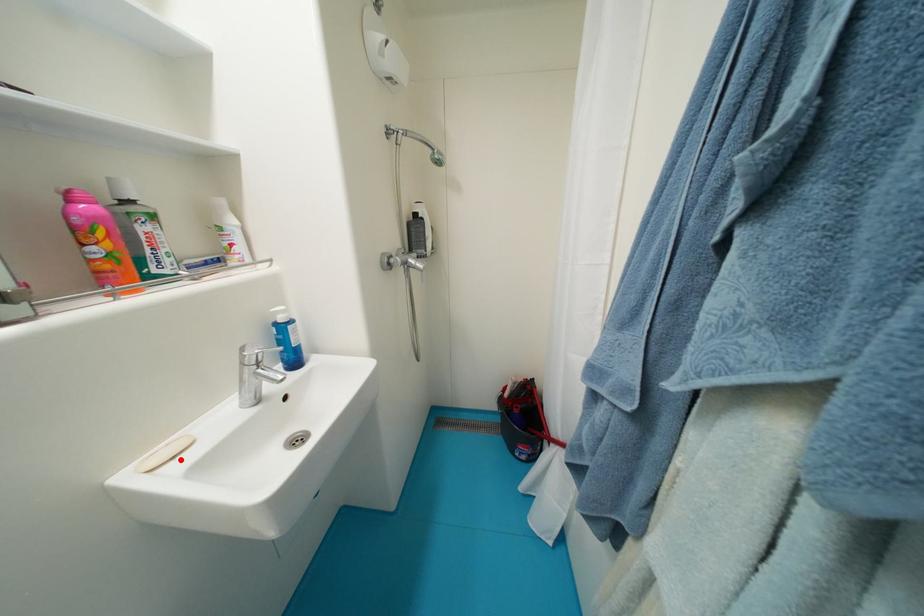
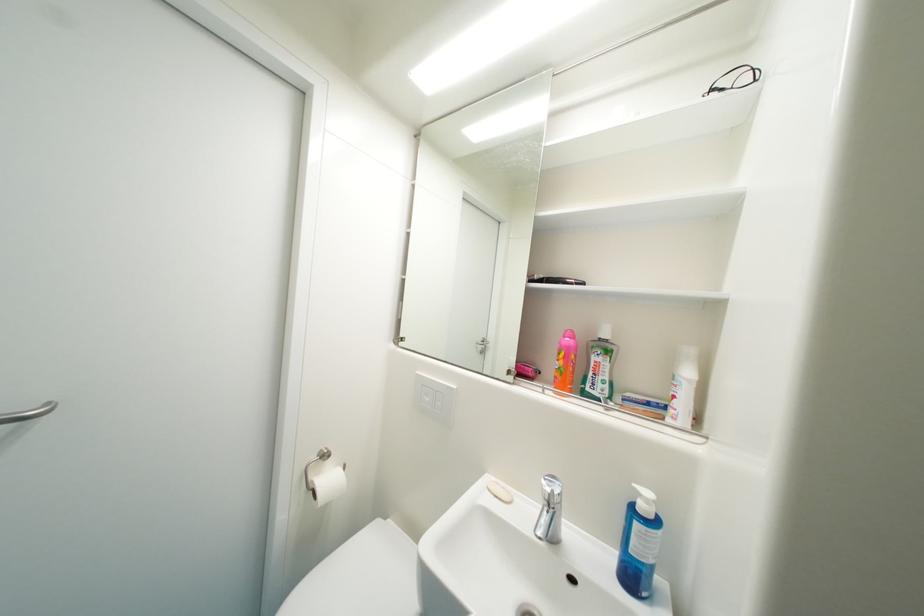
In the second image, find the point that corresponds to the highlighted location in the first image.

(503, 498)